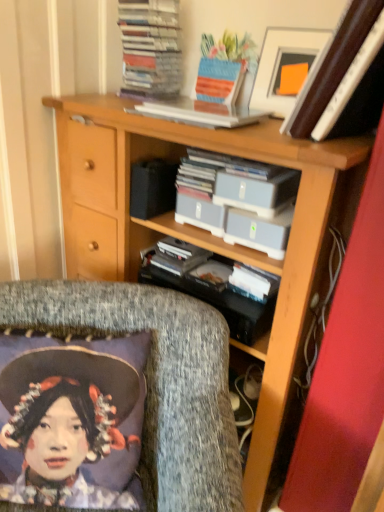
Locate an element on the screen. Image resolution: width=384 pixels, height=512 pixels. white glossy picture frame at upper right is located at coordinates (284, 67).

The height and width of the screenshot is (512, 384). What are the coordinates of `wooden bookcase at center` in the screenshot? It's located at (211, 238).

What is the approximate width of textured gray cushion at lower left?

26.99 inches.

Find the location of a particular element. textured gray cushion at lower left is located at coordinates [156, 379].

Locate an element on the screen. white glossy picture frame at upper right is located at coordinates (284, 67).

Image resolution: width=384 pixels, height=512 pixels. I want to click on picture frame above the white plastic book at upper center, arranged as the 2th book when viewed from the top (from the image's perspective), so click(x=284, y=67).

How far apart are white plastic book at upper center, arranged as the 2th book when viewed from the top, and white glossy picture frame at upper right?

white plastic book at upper center, arranged as the 2th book when viewed from the top, is 6.47 inches away from white glossy picture frame at upper right.

Between white plastic book at upper center, arranged as the 2th book when viewed from the top, and white glossy picture frame at upper right, which one is positioned in front?

white plastic book at upper center, arranged as the 2th book when viewed from the top, is closer to the camera.

Which object is wider, white plastic book at upper center, which appears as the first book when ordered from the bottom, or white glossy picture frame at upper right?

white plastic book at upper center, which appears as the first book when ordered from the bottom, is wider.

Considering the points (260, 448) and (226, 390), which point is in front, point (260, 448) or point (226, 390)?

Positioned in front is point (226, 390).

This screenshot has height=512, width=384. What are the coordinates of `bookcase to the right of textured gray cushion at lower left` in the screenshot? It's located at (211, 238).

Do you think wooden bookcase at center is within textured gray cushion at lower left, or outside of it?

The correct answer is: outside.

Relative to textured gray cushion at lower left, is wooden bookcase at center in front or behind?

wooden bookcase at center is behind textured gray cushion at lower left.

Looking at this image, relative to stacked paper at upper center, the 2th book positioned from the bottom, is textured gray cushion at lower left in front or behind?

Visually, textured gray cushion at lower left is located in front of stacked paper at upper center, the 2th book positioned from the bottom.

Considering the sizes of objects textured gray cushion at lower left and stacked paper at upper center, the 2th book positioned from the bottom, in the image provided, who is smaller, textured gray cushion at lower left or stacked paper at upper center, the 2th book positioned from the bottom,?

Smaller between the two is stacked paper at upper center, the 2th book positioned from the bottom.

From the picture: Is textured gray cushion at lower left to the left or to the right of stacked paper at upper center, the 2th book positioned from the bottom, in the image?

Based on their positions, textured gray cushion at lower left is located to the left of stacked paper at upper center, the 2th book positioned from the bottom.

Find the location of a particular element. the 2nd book above the textured gray cushion at lower left (from a real-world perspective) is located at coordinates (150, 46).

Does white plastic book at upper center, arranged as the 2th book when viewed from the top, turn towards textured gray cushion at lower left?

No, white plastic book at upper center, arranged as the 2th book when viewed from the top, is not aimed at textured gray cushion at lower left.

Between white plastic book at upper center, arranged as the 2th book when viewed from the top, and textured gray cushion at lower left, which one has smaller size?

white plastic book at upper center, arranged as the 2th book when viewed from the top, is smaller.

From the image's perspective, is white plastic book at upper center, which appears as the first book when ordered from the bottom, below textured gray cushion at lower left?

No, from the image's perspective, white plastic book at upper center, which appears as the first book when ordered from the bottom, is not beneath textured gray cushion at lower left.

Which object is thinner, white plastic book at upper center, arranged as the 2th book when viewed from the top, or textured gray cushion at lower left?

With smaller width is white plastic book at upper center, arranged as the 2th book when viewed from the top.

Considering the sizes of objects gray plastic case at center and matte plastic storage boxes at center in the image provided, who is shorter, gray plastic case at center or matte plastic storage boxes at center?

gray plastic case at center is shorter.

Between gray plastic case at center and matte plastic storage boxes at center, which one has larger size?

matte plastic storage boxes at center.

From a real-world perspective, is gray plastic case at center under matte plastic storage boxes at center?

No, from a real-world perspective, gray plastic case at center is not below matte plastic storage boxes at center.

Is gray plastic case at center in front of matte plastic storage boxes at center?

That is True.

Looking at this image, measure the distance between textured gray cushion at lower left and white plastic book at upper center, arranged as the 2th book when viewed from the top.

textured gray cushion at lower left and white plastic book at upper center, arranged as the 2th book when viewed from the top, are 23.48 inches apart from each other.

Can you confirm if textured gray cushion at lower left is thinner than white plastic book at upper center, which appears as the first book when ordered from the bottom?

In fact, textured gray cushion at lower left might be wider than white plastic book at upper center, which appears as the first book when ordered from the bottom.

This screenshot has width=384, height=512. In order to click on book that is the 2nd object to the right of the textured gray cushion at lower left, starting at the anchor in this screenshot , I will do `click(198, 113)`.

Could you tell me if textured gray cushion at lower left is facing white plastic book at upper center, which appears as the first book when ordered from the bottom?

No, textured gray cushion at lower left is not oriented towards white plastic book at upper center, which appears as the first book when ordered from the bottom.

Based on the photo, how many degrees apart are the facing directions of white plastic book at upper center, arranged as the 2th book when viewed from the top, and gray plastic case at center?

The angle between the facing direction of white plastic book at upper center, arranged as the 2th book when viewed from the top, and the facing direction of gray plastic case at center is 3.79 degrees.

Consider the image. Considering the sizes of objects white plastic book at upper center, which appears as the first book when ordered from the bottom, and gray plastic case at center in the image provided, who is thinner, white plastic book at upper center, which appears as the first book when ordered from the bottom, or gray plastic case at center?

Thinner between the two is white plastic book at upper center, which appears as the first book when ordered from the bottom.

In the scene shown: Is white plastic book at upper center, arranged as the 2th book when viewed from the top, positioned in front of gray plastic case at center?

Yes, it is in front of gray plastic case at center.

Is white plastic book at upper center, arranged as the 2th book when viewed from the top, beside gray plastic case at center?

No, white plastic book at upper center, arranged as the 2th book when viewed from the top, is not beside gray plastic case at center.

I want to click on book that appears in front of the white glossy picture frame at upper right, so click(198, 113).

Locate an element on the screen. The width and height of the screenshot is (384, 512). chair that appears on the left of wooden bookcase at center is located at coordinates (156, 379).

In the scene shown: Based on their spatial positions, is matte plastic storage boxes at center or gray plastic case at center closer to white glossy picture frame at upper right?

gray plastic case at center.

Estimate the real-world distances between objects in this image. Which object is further from white plastic book at upper center, which appears as the first book when ordered from the bottom, white glossy picture frame at upper right or textured gray cushion at lower left?

textured gray cushion at lower left.

When comparing their distances from white plastic book at upper center, which appears as the first book when ordered from the bottom, does gray plastic case at center or textured gray cushion at lower left seem further?

Based on the image, textured gray cushion at lower left appears to be further to white plastic book at upper center, which appears as the first book when ordered from the bottom.

Considering their positions, is gray plastic case at center positioned closer to white glossy picture frame at upper right than matte plastic storage boxes at center?

gray plastic case at center is closer to white glossy picture frame at upper right.

Considering their positions, is matte plastic storage boxes at center positioned further to gray plastic case at center than textured gray cushion at lower left?

textured gray cushion at lower left is further to gray plastic case at center.

Looking at the image, which one is located closer to matte plastic storage boxes at center, gray plastic case at center or stacked paper at upper center, the 2th book positioned from the bottom?

The object closer to matte plastic storage boxes at center is gray plastic case at center.

In the scene shown: Considering their positions, is white plastic book at upper center, arranged as the 2th book when viewed from the top, positioned closer to wooden bookcase at center than textured gray cushion at lower left?

textured gray cushion at lower left is closer to wooden bookcase at center.

Estimate the real-world distances between objects in this image. Which object is further from textured gray cushion at lower left, stacked paper at upper center, the 2th book positioned from the bottom, or matte plastic storage boxes at center?

Based on the image, stacked paper at upper center, the 2th book positioned from the bottom, appears to be further to textured gray cushion at lower left.

Find the location of `bookcase between white plastic book at upper center, which appears as the first book when ordered from the bottom, and textured gray cushion at lower left from top to bottom`. bookcase between white plastic book at upper center, which appears as the first book when ordered from the bottom, and textured gray cushion at lower left from top to bottom is located at coordinates (211, 238).

Where is `paperback book between stacked paper at upper center, the 2th book positioned from the bottom, and textured gray cushion at lower left from top to bottom`? paperback book between stacked paper at upper center, the 2th book positioned from the bottom, and textured gray cushion at lower left from top to bottom is located at coordinates (256, 191).

At what (x,y) coordinates should I click in order to perform the action: click on bookcase between stacked paper at upper center, the 2th book positioned from the bottom, and textured gray cushion at lower left vertically. Please return your answer as a coordinate pair (x, y). This screenshot has width=384, height=512. Looking at the image, I should click on (211, 238).

Locate an element on the screen. The image size is (384, 512). shelf between gray plastic case at center and wooden bookcase at center in the vertical direction is located at coordinates (205, 244).